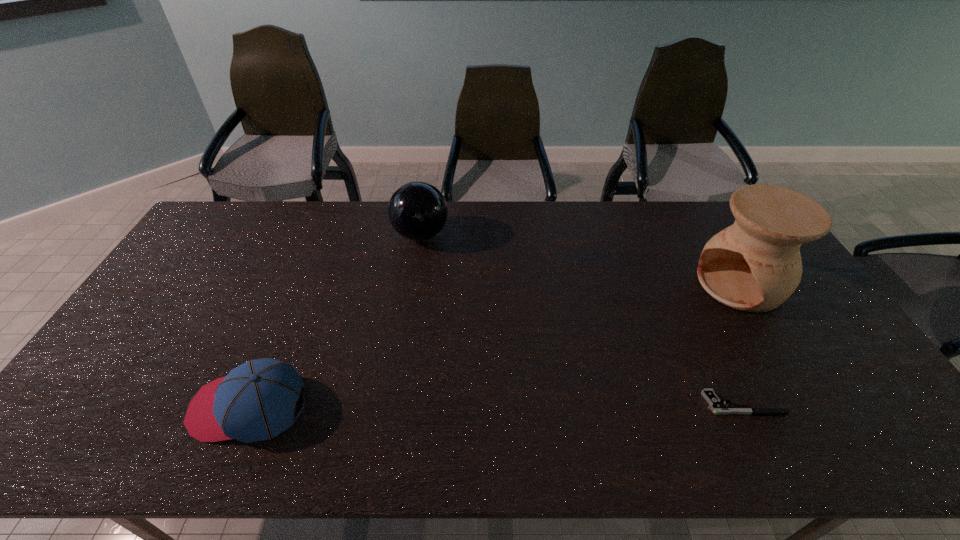
You are a GUI agent. You are given a task and a screenshot of the screen. Output one action in this format:
    pyautogui.click(x=<x>, y=<y>)
    Task: Click on the vacant spot on the desktop that is between the baseball cap and the shortest object and is positioned at the open side of the third nearest object
    This screenshot has height=540, width=960.
    Given the screenshot: What is the action you would take?
    pyautogui.click(x=526, y=405)

Locate an element on the screen. The height and width of the screenshot is (540, 960). free space on the desktop that is between the second shortest object and the pistol and is positioned on the side of the farthest object with the finger holes is located at coordinates [x=488, y=405].